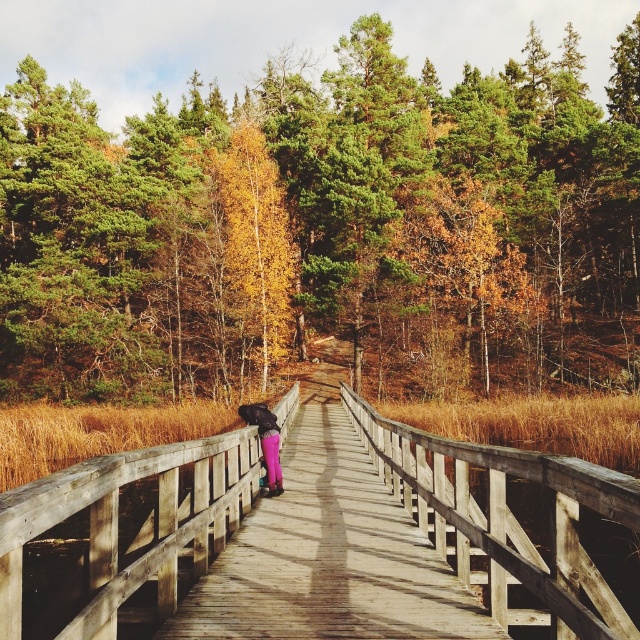
Describe the element at coordinates (124, 531) in the screenshot. Image resolution: width=640 pixels, height=640 pixels. I see `wooden bridge at center` at that location.

Which is behind, point (243, 483) or point (257, 428)?

The point (257, 428) is behind.

This screenshot has height=640, width=640. What do you see at coordinates (124, 531) in the screenshot?
I see `wooden bridge at center` at bounding box center [124, 531].

You are a GUI agent. You are given a task and a screenshot of the screen. Output one action in this format:
    pyautogui.click(x=<x>, y=<y>)
    Task: Click on the wooden bridge at center
    
    Given the screenshot: What is the action you would take?
    pyautogui.click(x=124, y=531)

Who is taller, green textured trees at upper center or wooden bridge at center?

Standing taller between the two is green textured trees at upper center.

Who is higher up, green textured trees at upper center or wooden bridge at center?

green textured trees at upper center is above.

Does point (86, 358) come farther from viewer compared to point (499, 506)?

Yes.

You are a GUI agent. You are given a task and a screenshot of the screen. Output one action in this format:
    pyautogui.click(x=<x>, y=<y>)
    Task: Click on the green textured trees at upper center
    Image resolution: width=640 pixels, height=640 pixels.
    Given the screenshot: What is the action you would take?
    pyautogui.click(x=324, y=227)

Which of these two, green textured trees at upper center or purple matte pants at center, stands taller?

With more height is green textured trees at upper center.

Is green textured trees at upper center to the right of purple matte pants at center from the viewer's perspective?

Indeed, green textured trees at upper center is positioned on the right side of purple matte pants at center.

Is point (216, 124) less distant than point (275, 420)?

No, it is behind (275, 420).

You are a GUI agent. You are given a task and a screenshot of the screen. Output one action in this format:
    pyautogui.click(x=<x>, y=<y>)
    Task: Click on the green textured trees at upper center
    
    Given the screenshot: What is the action you would take?
    pyautogui.click(x=324, y=227)